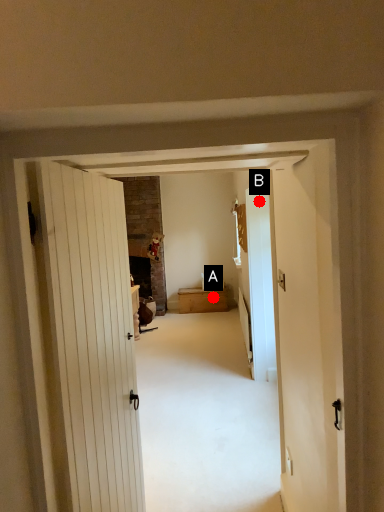
Question: Two points are circled on the image, labeled by A and B beside each circle. Which point is closer to the camera taking this photo?

Choices:
 (A) A is closer
 (B) B is closer

Answer: (B)